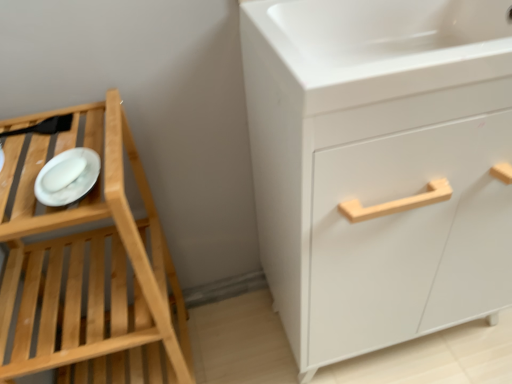
What do you see at coordinates (388, 41) in the screenshot?
I see `white glossy sink at upper right` at bounding box center [388, 41].

Measure the distance between white glossy sink at upper right and camera.

A distance of 21.94 inches exists between white glossy sink at upper right and camera.

Describe the element at coordinates (379, 166) in the screenshot. Image resolution: width=512 pixels, height=384 pixels. I see `white matte cabinet at right` at that location.

Measure the distance between point (144, 267) and camera.

The distance of point (144, 267) from camera is 26.65 inches.

This screenshot has width=512, height=384. In order to click on white glossy sink at upper right in this screenshot , I will do `click(388, 41)`.

From the picture: Who is smaller, white matte platter at left or white matte cabinet at right?

Smaller between the two is white matte platter at left.

Is point (96, 169) closer or farther from the camera than point (339, 173)?

Point (96, 169) is positioned farther from the camera compared to point (339, 173).

Considering the sizes of objects white matte platter at left and white matte cabinet at right in the image provided, who is thinner, white matte platter at left or white matte cabinet at right?

With smaller width is white matte platter at left.

Between white glossy sink at upper right and natural wood tray at left, which one has larger width?

natural wood tray at left.

Is point (487, 66) closer to camera compared to point (14, 124)?

Yes, it is.

From the image's perspective, is white glossy sink at upper right below natural wood tray at left?

Incorrect, from the image's perspective, white glossy sink at upper right is higher than natural wood tray at left.

From the image's perspective, which object appears higher, white matte platter at left or white glossy sink at upper right?

white glossy sink at upper right, from the image's perspective.

In the scene shown: Can you confirm if white matte platter at left is smaller than white glossy sink at upper right?

Yes, white matte platter at left is smaller than white glossy sink at upper right.

From the picture: Is white matte platter at left positioned before white glossy sink at upper right?

Yes, the depth of white matte platter at left is less than that of white glossy sink at upper right.

Considering the positions of points (44, 184) and (435, 43), is point (44, 184) farther from camera compared to point (435, 43)?

That is False.

The width and height of the screenshot is (512, 384). Identify the location of sink above the white matte platter at left (from the image's perspective). (388, 41).

From a real-world perspective, does white glossy sink at upper right stand above white matte platter at left?

Yes, from a real-world perspective, white glossy sink at upper right is on top of white matte platter at left.

Is white glossy sink at upper right to the left or to the right of white matte platter at left in the image?

white glossy sink at upper right is to the right of white matte platter at left.

Is white matte cabinet at right positioned behind natural wood tray at left?

Yes, it is.

Between white matte cabinet at right and natural wood tray at left, which one has smaller size?

natural wood tray at left.

I want to click on the chest of drawers positioned vertically above the natural wood tray at left (from a real-world perspective), so click(379, 166).

What's the angular difference between white glossy sink at upper right and white matte cabinet at right's facing directions?

The angle between the facing direction of white glossy sink at upper right and the facing direction of white matte cabinet at right is 1.95 degrees.

Identify the location of chest of drawers on the right side of white glossy sink at upper right. (379, 166).

Is white glossy sink at upper right wider than white matte cabinet at right?

Incorrect, the width of white glossy sink at upper right does not surpass that of white matte cabinet at right.

From their relative heights in the image, would you say white glossy sink at upper right is taller or shorter than white matte cabinet at right?

white glossy sink at upper right is shorter than white matte cabinet at right.

From a real-world perspective, is white matte platter at left physically above natural wood tray at left?

Indeed, from a real-world perspective, white matte platter at left stands above natural wood tray at left.

Can you tell me how much white matte platter at left and natural wood tray at left differ in facing direction?

The angular difference between white matte platter at left and natural wood tray at left is 0.466 degrees.

Is white matte platter at left to the right of natural wood tray at left from the viewer's perspective?

Correct, you'll find white matte platter at left to the right of natural wood tray at left.

I want to click on platter lying above the white matte cabinet at right (from the image's perspective), so click(67, 177).

You are a GUI agent. You are given a task and a screenshot of the screen. Output one action in this format:
    pyautogui.click(x=<x>, y=<y>)
    Task: Click on the sink positioned vertically above the natural wood tray at left (from a real-world perspective)
    This screenshot has width=512, height=384.
    Given the screenshot: What is the action you would take?
    pyautogui.click(x=388, y=41)

Considering their positions, is natural wood tray at left positioned closer to white matte platter at left than white glossy sink at upper right?

natural wood tray at left is positioned closer to the anchor white matte platter at left.

Looking at the image, which one is located further to white glossy sink at upper right, natural wood tray at left or white matte cabinet at right?

natural wood tray at left is further to white glossy sink at upper right.

From the image, which object appears to be nearer to white matte cabinet at right, white matte platter at left or natural wood tray at left?

natural wood tray at left.

When comparing their distances from natural wood tray at left, does white glossy sink at upper right or white matte cabinet at right seem closer?

white matte cabinet at right lies closer to natural wood tray at left than the other object.

Which object lies further to the anchor point white matte platter at left, natural wood tray at left or white matte cabinet at right?

The object further to white matte platter at left is white matte cabinet at right.

Looking at the image, which one is located further to white glossy sink at upper right, natural wood tray at left or white matte platter at left?

Based on the image, natural wood tray at left appears to be further to white glossy sink at upper right.

Estimate the real-world distances between objects in this image. Which object is closer to white matte platter at left, white glossy sink at upper right or white matte cabinet at right?

The object closer to white matte platter at left is white glossy sink at upper right.

When comparing their distances from white matte cabinet at right, does natural wood tray at left or white matte platter at left seem closer?

Based on the image, natural wood tray at left appears to be nearer to white matte cabinet at right.

Identify the location of sink situated between natural wood tray at left and white matte cabinet at right from left to right. (388, 41).

Find the location of a particular element. The height and width of the screenshot is (384, 512). sink between white matte platter at left and white matte cabinet at right is located at coordinates point(388,41).

Find the location of `platter between natural wood tray at left and white glossy sink at upper right from left to right`. platter between natural wood tray at left and white glossy sink at upper right from left to right is located at coordinates (67, 177).

Where is `platter between natural wood tray at left and white matte cabinet at right`? This screenshot has width=512, height=384. platter between natural wood tray at left and white matte cabinet at right is located at coordinates (67, 177).